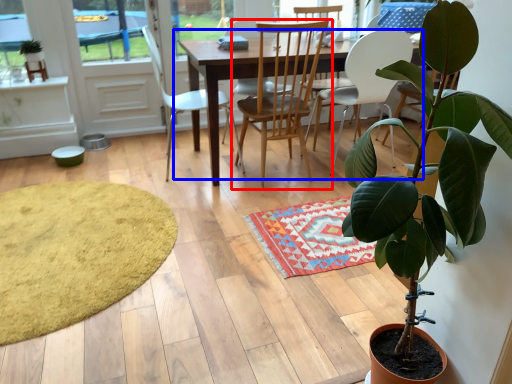
Question: Among these objects, which one is farthest to the camera, chair (highlighted by a red box) or kitchen & dining room table (highlighted by a blue box)?

Choices:
 (A) chair
 (B) kitchen & dining room table

Answer: (B)